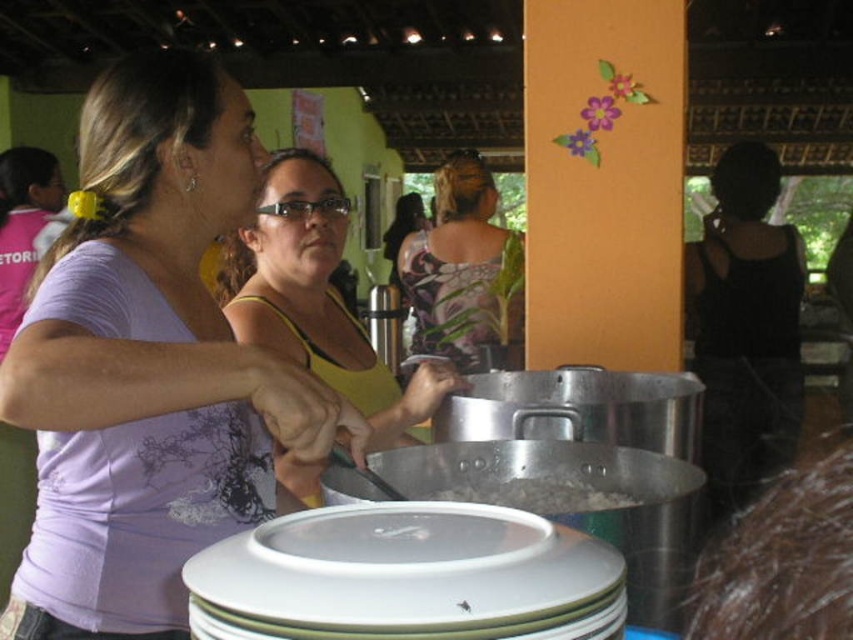
Question: Which object appears farthest from the camera in this image?

Choices:
 (A) white glossy platter at center
 (B) purple fabric shirt at upper left
 (C) gray metallic rice at center
 (D) floral-patterned fabric at center

Answer: (D)

Question: Considering the real-world distances, which object is farthest from the purple fabric shirt at upper left?

Choices:
 (A) yellow-green tank top at center
 (B) white glossy platter at center
 (C) floral-patterned fabric at center
 (D) gray metallic rice at center

Answer: (C)

Question: Estimate the real-world distances between objects in this image. Which object is farther from the yellow-green tank top at center?

Choices:
 (A) white glossy platter at center
 (B) floral-patterned fabric at center

Answer: (B)

Question: In this image, where is white glossy platter at center located relative to yellow-green tank top at center?

Choices:
 (A) above
 (B) below

Answer: (B)

Question: Observing the image, what is the correct spatial positioning of black matte tank top at right in reference to floral-patterned fabric at center?

Choices:
 (A) left
 (B) right

Answer: (B)

Question: Can you confirm if purple fabric shirt at upper left is positioned below white glossy platter at center?

Choices:
 (A) no
 (B) yes

Answer: (A)